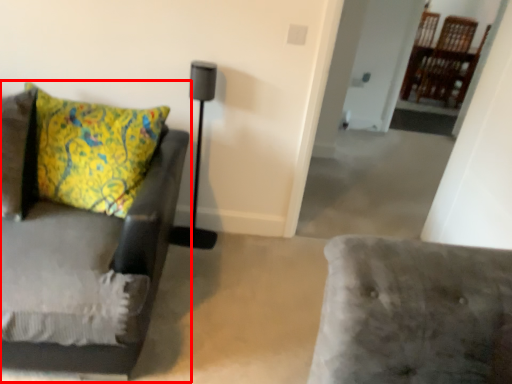
Question: From the image's perspective, considering the relative positions of studio couch (annotated by the red box) and table lamp in the image provided, where is studio couch (annotated by the red box) located with respect to the staircase?

Choices:
 (A) below
 (B) above

Answer: (A)